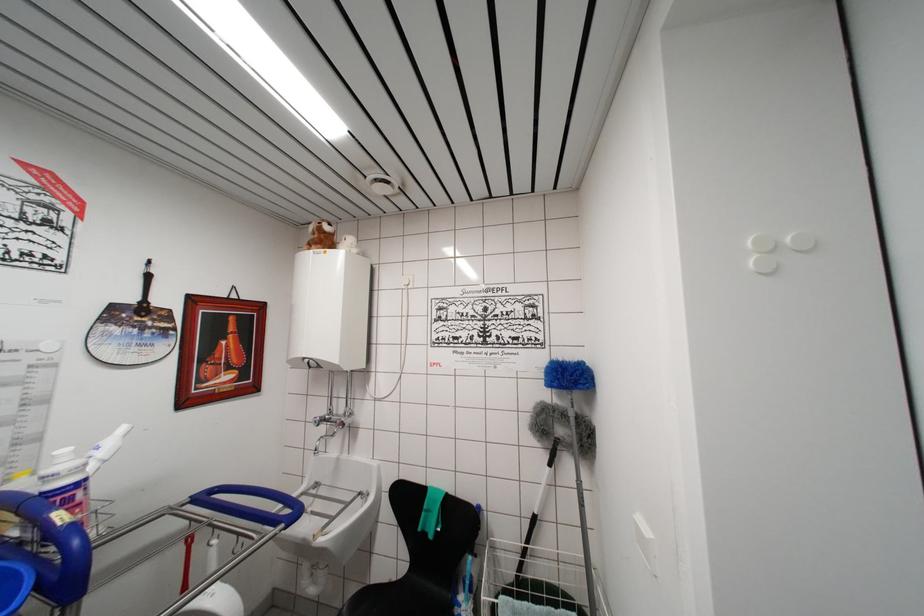
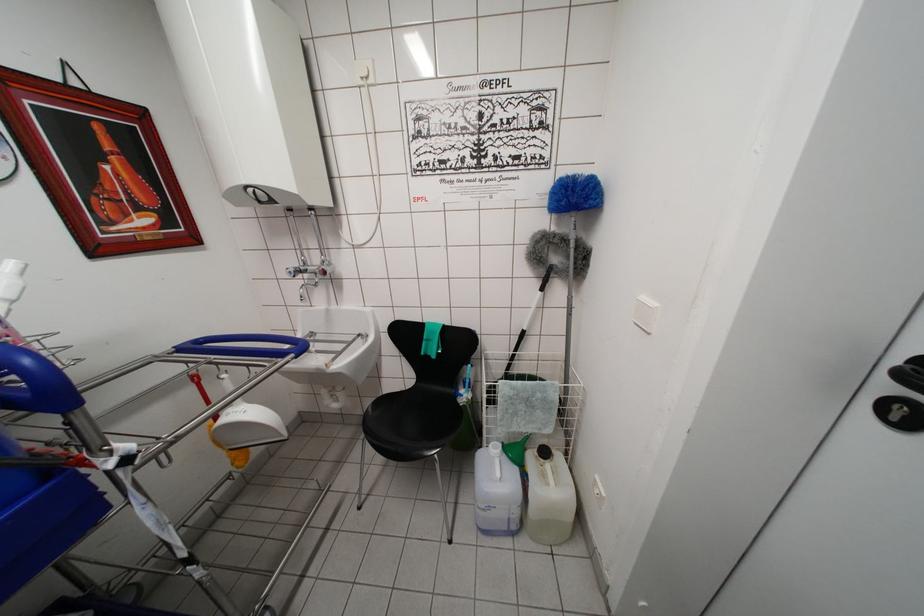
Where in the second image is the point corresponding to pixel 332 525 from the first image?

(338, 360)